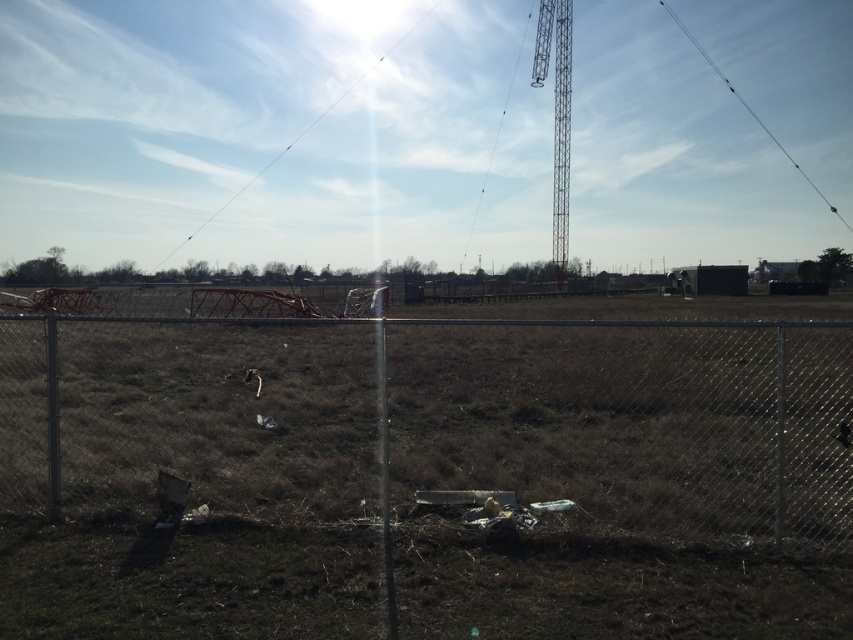
Question: Estimate the real-world distances between objects in this image. Which object is farther from the metallic wire at upper center?

Choices:
 (A) metallic tower at upper right
 (B) black wire at upper right

Answer: (B)

Question: Does transparent wire at upper center appear on the right side of metallic wire at upper center?

Choices:
 (A) yes
 (B) no

Answer: (B)

Question: Among these objects, which one is farthest from the camera?

Choices:
 (A) black wire at upper right
 (B) metallic tower at upper right
 (C) metallic wire at upper center

Answer: (A)

Question: Is transparent wire at upper center smaller than black wire at upper right?

Choices:
 (A) no
 (B) yes

Answer: (A)

Question: Which object is the closest to the transparent wire at upper center?

Choices:
 (A) metallic tower at upper right
 (B) black wire at upper right

Answer: (A)

Question: Does metal chain-link fence at center appear on the left side of black wire at upper right?

Choices:
 (A) no
 (B) yes

Answer: (B)